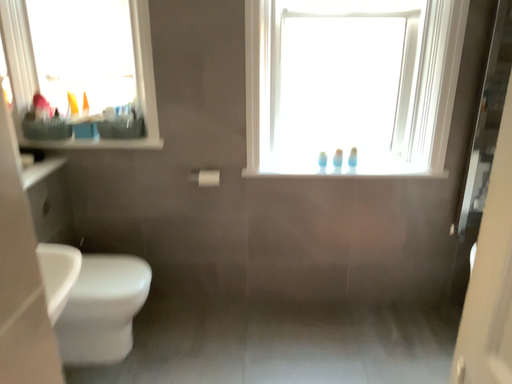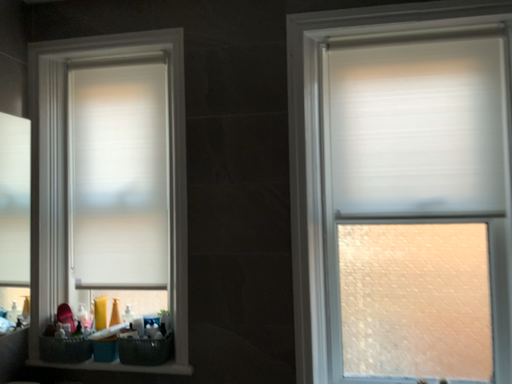
Question: Which way did the camera rotate in the video?

Choices:
 (A) rotated left
 (B) rotated right

Answer: (A)